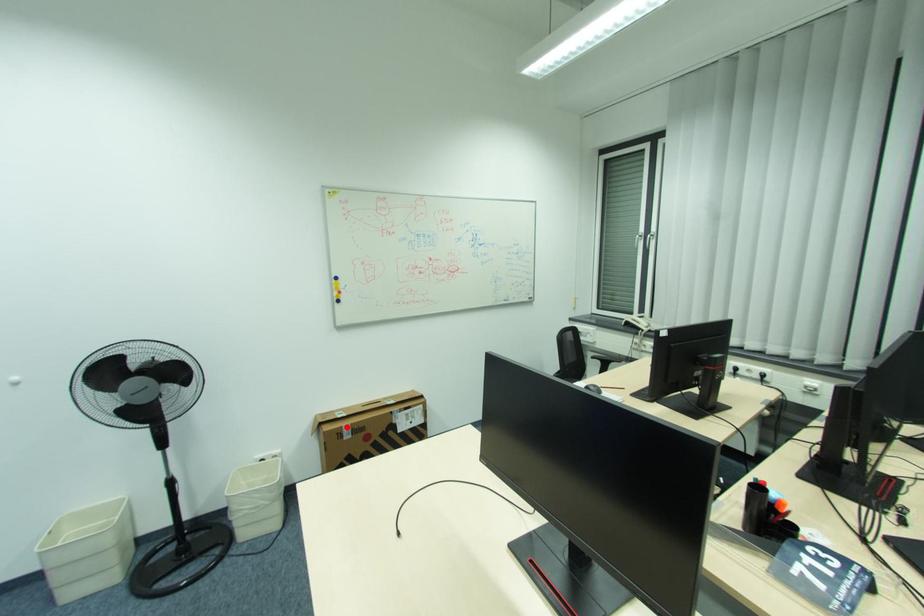
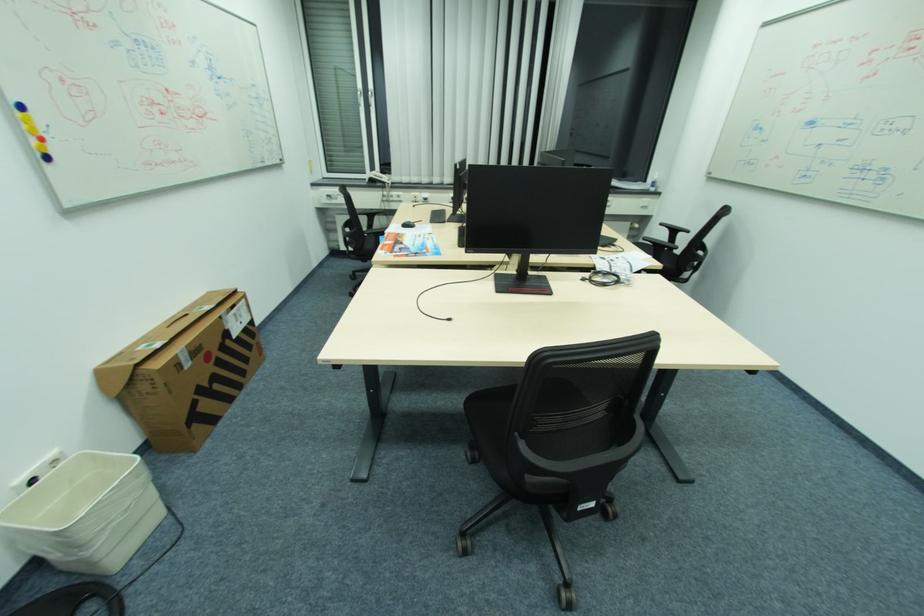
Locate, in the second image, the point that corresponds to the highlighted location in the first image.

(181, 355)